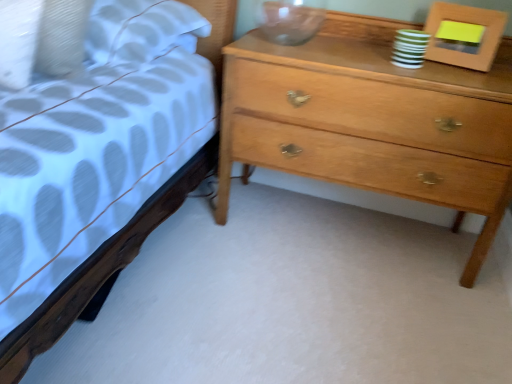
Question: Should I look upward or downward to see wooden picture frame at upper right?

Choices:
 (A) up
 (B) down

Answer: (A)

Question: Considering the relative sizes of wooden picture frame at upper right and light brown wood chest of drawers at right in the image provided, is wooden picture frame at upper right taller than light brown wood chest of drawers at right?

Choices:
 (A) yes
 (B) no

Answer: (B)

Question: From a real-world perspective, is wooden picture frame at upper right beneath light brown wood chest of drawers at right?

Choices:
 (A) no
 (B) yes

Answer: (A)

Question: From the image's perspective, does wooden picture frame at upper right appear lower than light brown wood chest of drawers at right?

Choices:
 (A) yes
 (B) no

Answer: (B)

Question: From the image's perspective, is wooden picture frame at upper right on top of light brown wood chest of drawers at right?

Choices:
 (A) no
 (B) yes

Answer: (B)

Question: Is wooden picture frame at upper right positioned far away from light brown wood chest of drawers at right?

Choices:
 (A) yes
 (B) no

Answer: (B)

Question: Is wooden picture frame at upper right at the right side of light brown wood chest of drawers at right?

Choices:
 (A) yes
 (B) no

Answer: (A)

Question: Is light brown wood chest of drawers at right closer to the viewer compared to wooden picture frame at upper right?

Choices:
 (A) yes
 (B) no

Answer: (A)

Question: Is light brown wood chest of drawers at right further to camera compared to wooden picture frame at upper right?

Choices:
 (A) no
 (B) yes

Answer: (A)

Question: Does light brown wood chest of drawers at right have a smaller size compared to wooden picture frame at upper right?

Choices:
 (A) yes
 (B) no

Answer: (B)

Question: Is light brown wood chest of drawers at right to the right of wooden picture frame at upper right from the viewer's perspective?

Choices:
 (A) yes
 (B) no

Answer: (B)

Question: Can you confirm if light brown wood chest of drawers at right is wider than wooden picture frame at upper right?

Choices:
 (A) no
 (B) yes

Answer: (B)

Question: Is light brown wood chest of drawers at right bigger than wooden picture frame at upper right?

Choices:
 (A) yes
 (B) no

Answer: (A)

Question: From a real-world perspective, is wooden picture frame at upper right above or below light brown wood chest of drawers at right?

Choices:
 (A) above
 (B) below

Answer: (A)